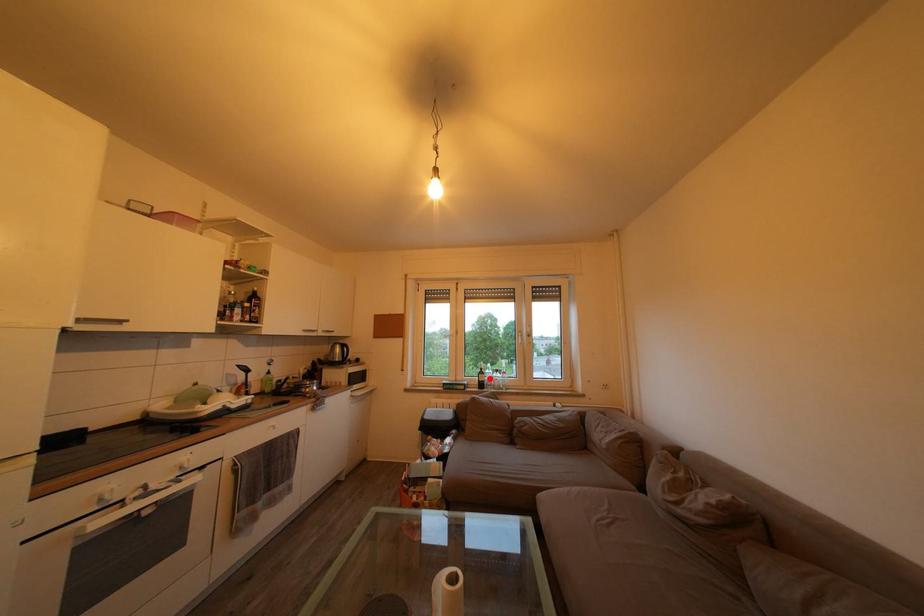
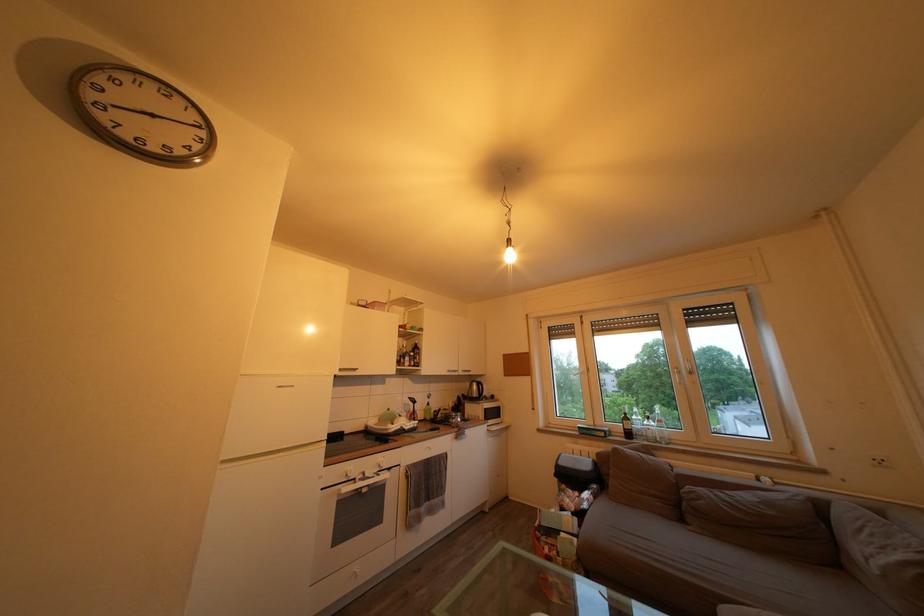
Find the pixel in the second image that matches the highlighted location in the first image.

(635, 424)